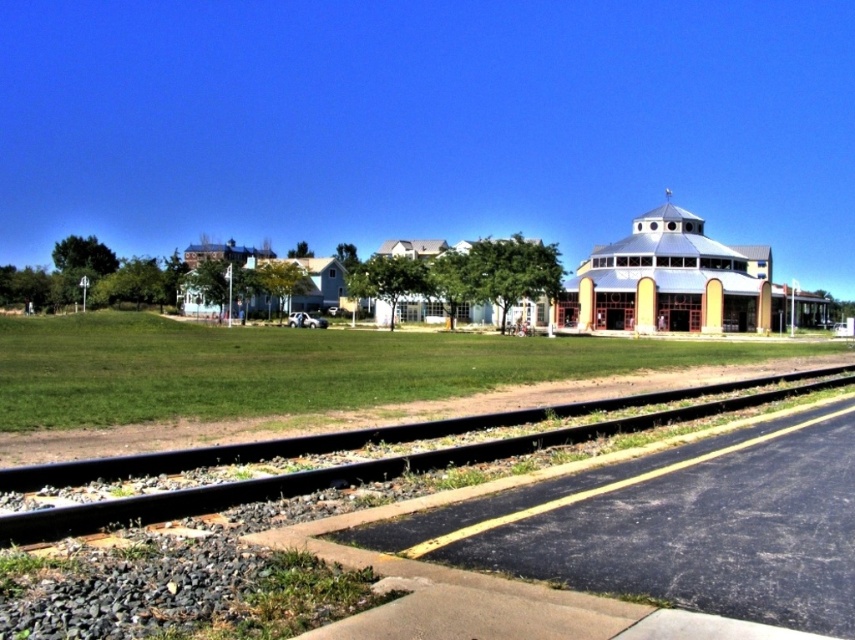
Consider the image. Is metallic blue dome at center thinner than black metal train track at lower center?

Incorrect, metallic blue dome at center's width is not less than black metal train track at lower center's.

Which is below, metallic blue dome at center or black metal train track at lower center?

Positioned lower is black metal train track at lower center.

Is point (643, 328) farther from camera compared to point (9, 515)?

Yes, point (643, 328) is farther from viewer.

At what (x,y) coordinates should I click in order to perform the action: click on metallic blue dome at center. Please return your answer as a coordinate pair (x, y). The height and width of the screenshot is (640, 855). Looking at the image, I should click on (679, 282).